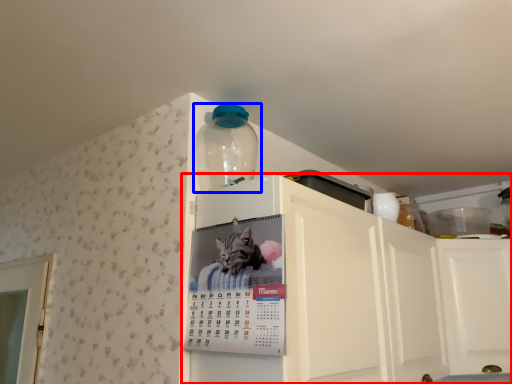
Question: Which object is further to the camera taking this photo, cabinetry (highlighted by a red box) or bottle (highlighted by a blue box)?

Choices:
 (A) cabinetry
 (B) bottle

Answer: (B)